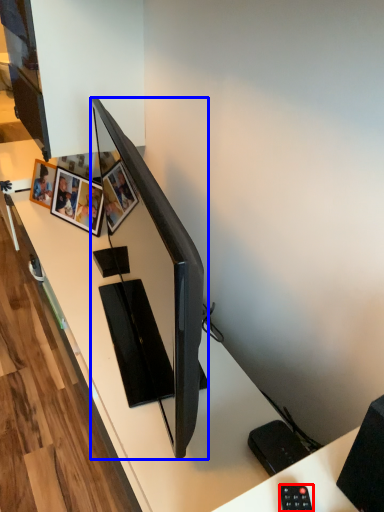
Question: Among these objects, which one is farthest to the camera, control (highlighted by a red box) or television (highlighted by a blue box)?

Choices:
 (A) control
 (B) television

Answer: (B)